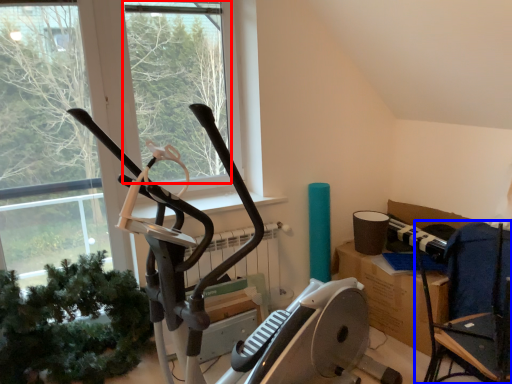
Question: Among these objects, which one is farthest to the camera, window screen (highlighted by a red box) or chair (highlighted by a blue box)?

Choices:
 (A) window screen
 (B) chair

Answer: (A)